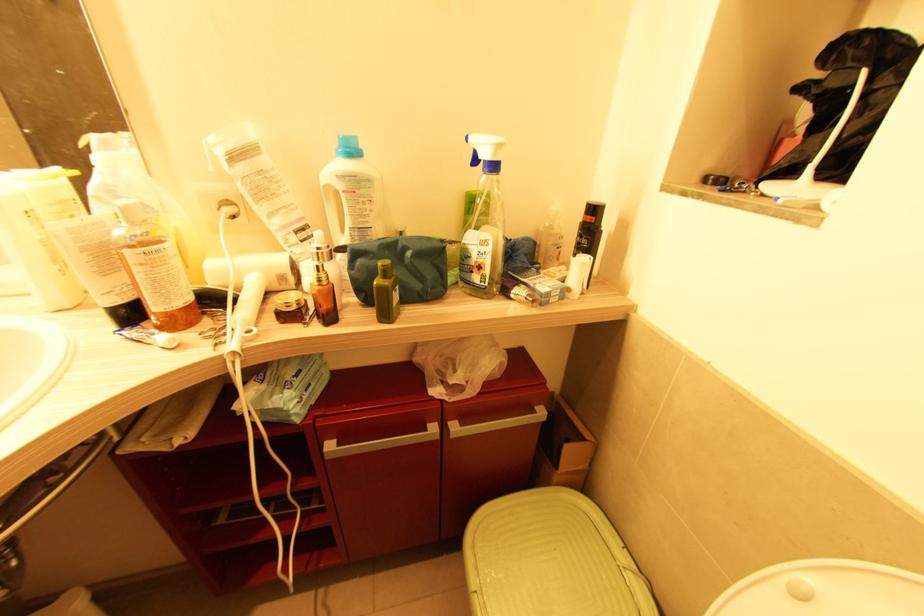
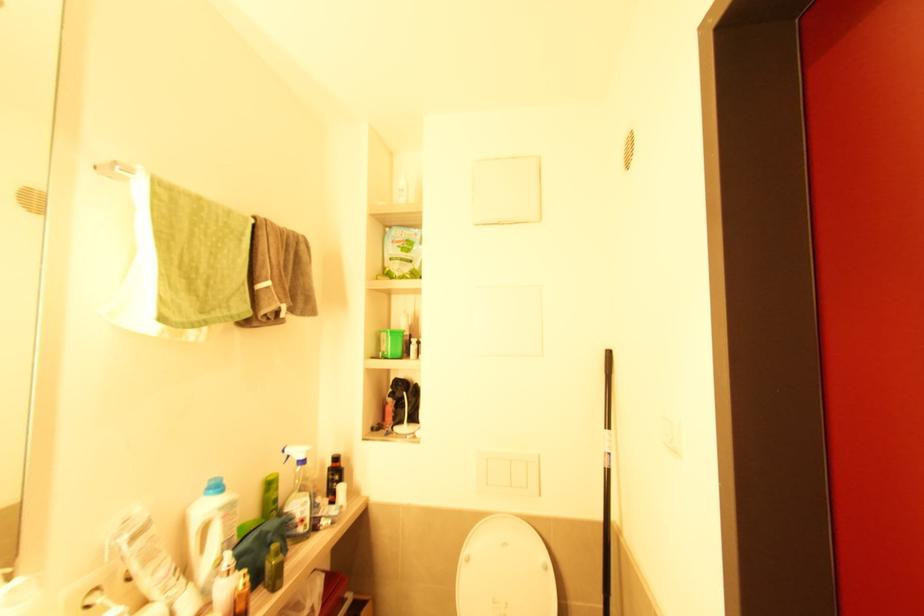
In the second image, find the point that corresponds to pixel 321 282 in the first image.

(247, 585)